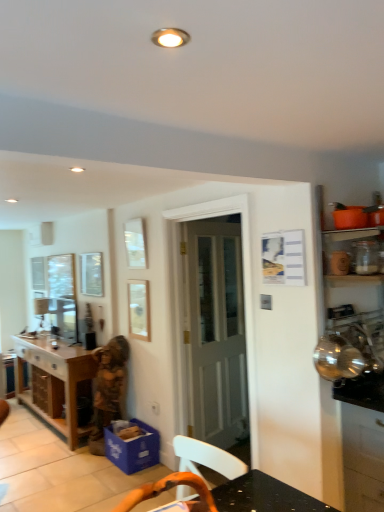
I want to click on free spot in front of blue cardboard box at lower center, the second cabinetry when ordered from front to back, so click(125, 478).